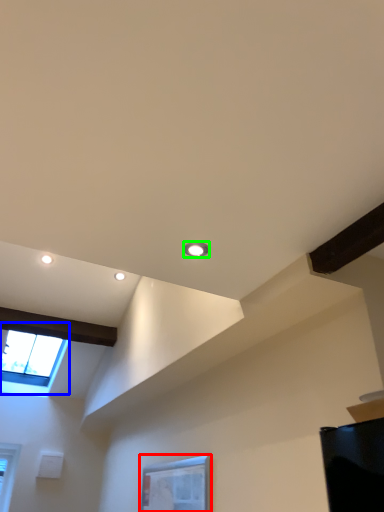
Question: Considering the real-world distances, which object is farthest from window (highlighted by a red box)? window (highlighted by a blue box) or droplight (highlighted by a green box)?

Choices:
 (A) window
 (B) droplight

Answer: (A)